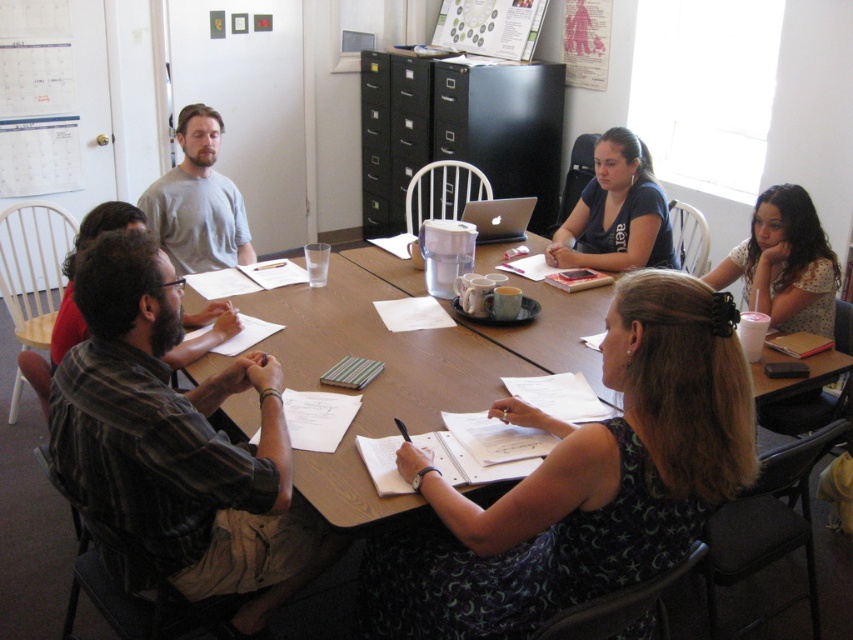
Is point (389, 381) farther from viewer compared to point (167, 216)?

No.

Between wooden table at center and gray cotton shirt at upper left, which one is positioned higher?

gray cotton shirt at upper left is higher up.

Locate an element on the screen. This screenshot has width=853, height=640. wooden table at center is located at coordinates (405, 364).

Which is behind, point (131, 445) or point (651, 192)?

Point (651, 192)

Is point (167, 561) positioned in front of point (566, 237)?

Yes, it is.

Where is `striped cotton shirt at lower left`? This screenshot has height=640, width=853. striped cotton shirt at lower left is located at coordinates (175, 449).

Can you confirm if wooden table at center is positioned below dark blue t-shirt at upper right?

Yes, wooden table at center is below dark blue t-shirt at upper right.

Is point (476, 378) positioned behind point (602, 192)?

No, (476, 378) is closer to viewer.

Between point (486, 369) and point (611, 216), which one is positioned in front?

Point (486, 369) is in front.

Find the location of a particular element. wooden table at center is located at coordinates (405, 364).